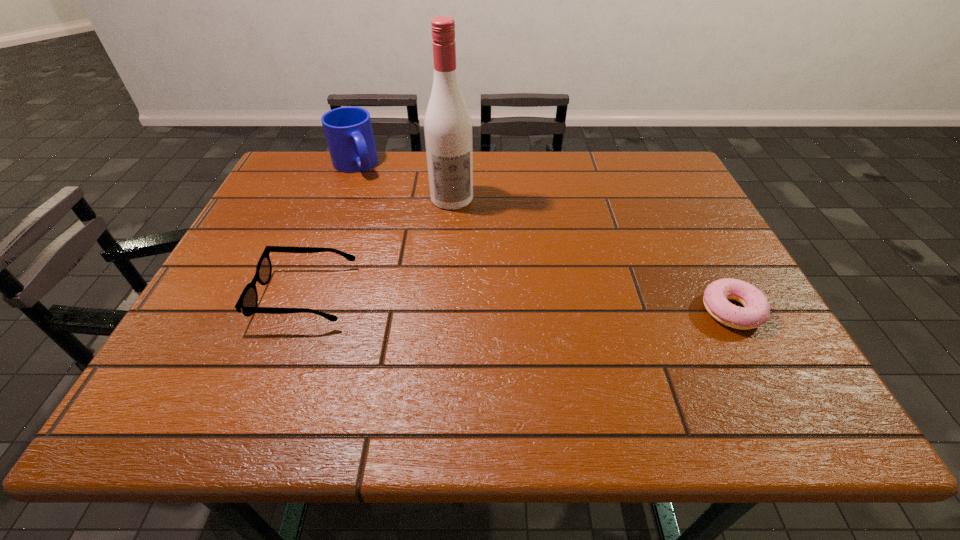
Where is `the third closest object to the farthest object`? the third closest object to the farthest object is located at coordinates (756, 310).

Identify which object is the second closest to the third nearest object. Please provide its 2D coordinates. Your answer should be formatted as a tuple, i.e. [(x, y)], where the tuple contains the x and y coordinates of a point satisfying the conditions above.

[(247, 303)]